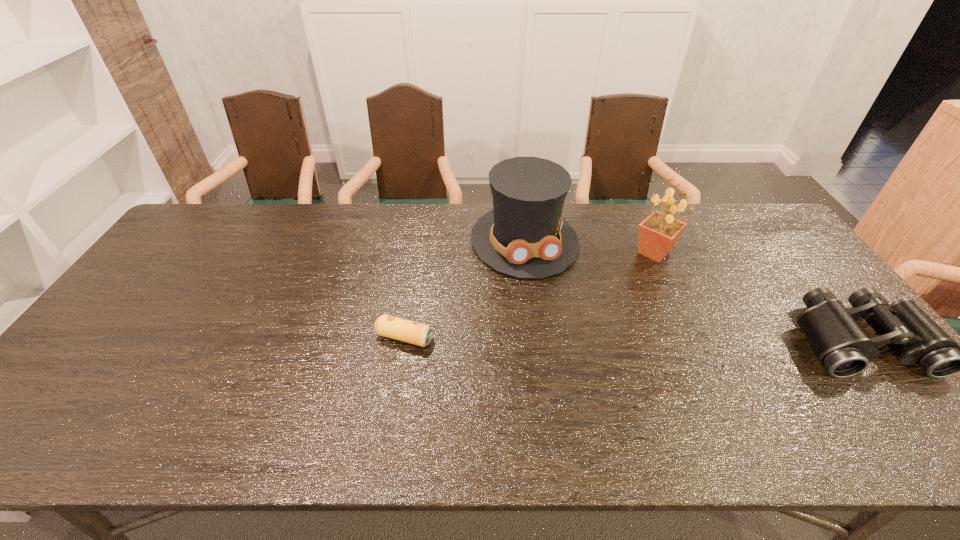
Locate an element on the screen. free area in between the third object from right to left and the second object from right to left is located at coordinates (589, 246).

The height and width of the screenshot is (540, 960). Find the location of `free space between the rightmost object and the second object from left to right`. free space between the rightmost object and the second object from left to right is located at coordinates (691, 290).

Locate an element on the screen. object that stands as the second closest to the beer can is located at coordinates (658, 233).

Identify the location of object that ranks as the closest to the leftmost object. The height and width of the screenshot is (540, 960). (524, 236).